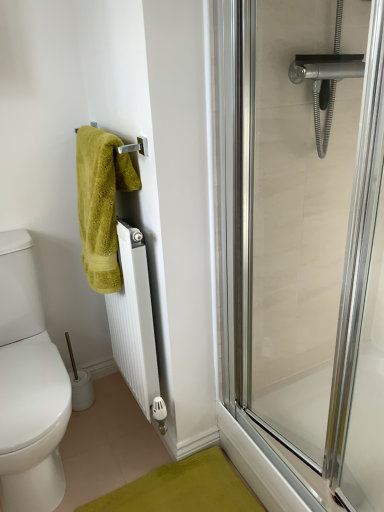
Question: Should I look upward or downward to see clear glass shower door at right?

Choices:
 (A) up
 (B) down

Answer: (B)

Question: Is white plastic toilet paper at lower left far from clear glass shower door at right?

Choices:
 (A) no
 (B) yes

Answer: (B)

Question: From the image's perspective, is white plastic toilet paper at lower left on clear glass shower door at right?

Choices:
 (A) no
 (B) yes

Answer: (A)

Question: Can you confirm if white plastic toilet paper at lower left is shorter than clear glass shower door at right?

Choices:
 (A) yes
 (B) no

Answer: (A)

Question: From a real-world perspective, is white plastic toilet paper at lower left positioned over clear glass shower door at right based on gravity?

Choices:
 (A) yes
 (B) no

Answer: (B)

Question: Does white plastic toilet paper at lower left have a greater height compared to clear glass shower door at right?

Choices:
 (A) no
 (B) yes

Answer: (A)

Question: From the image's perspective, is white plastic toilet paper at lower left beneath clear glass shower door at right?

Choices:
 (A) no
 (B) yes

Answer: (B)

Question: Considering the relative sizes of green fuzzy towel at upper left and white matte radiator at center in the image provided, is green fuzzy towel at upper left taller than white matte radiator at center?

Choices:
 (A) no
 (B) yes

Answer: (A)

Question: From the image's perspective, does green fuzzy towel at upper left appear higher than white matte radiator at center?

Choices:
 (A) no
 (B) yes

Answer: (B)

Question: Is green fuzzy towel at upper left not within white matte radiator at center?

Choices:
 (A) no
 (B) yes

Answer: (B)

Question: From a real-world perspective, does green fuzzy towel at upper left stand above white matte radiator at center?

Choices:
 (A) no
 (B) yes

Answer: (B)

Question: Is green fuzzy towel at upper left wider than white matte radiator at center?

Choices:
 (A) no
 (B) yes

Answer: (B)

Question: Does green fuzzy towel at upper left have a larger size compared to white matte radiator at center?

Choices:
 (A) yes
 (B) no

Answer: (B)

Question: Does white matte radiator at center appear on the left side of clear glass shower door at right?

Choices:
 (A) yes
 (B) no

Answer: (A)